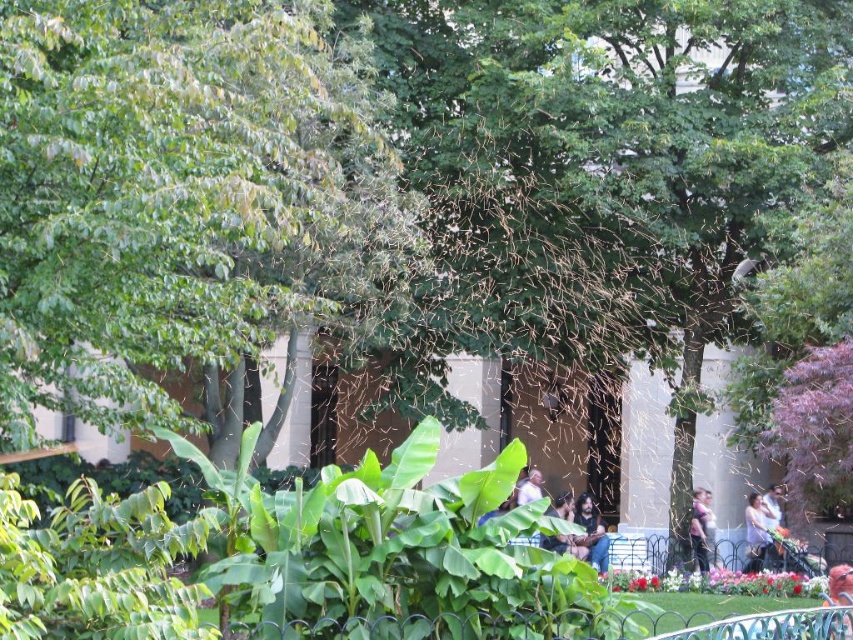
This screenshot has width=853, height=640. I want to click on smooth skin person at lower right, so click(x=755, y=532).

Measure the distance between point (747,502) and camera.

Point (747,502) is 37.67 meters from camera.

Where is `smooth skin person at lower right`? smooth skin person at lower right is located at coordinates (755, 532).

Is point (598, 540) positioned after point (761, 547)?

Yes, point (598, 540) is behind point (761, 547).

Measure the distance between dark brown leather jacket at center and camera.

109.44 feet

Identify the location of dark brown leather jacket at center. (590, 531).

I want to click on dark brown leather jacket at center, so click(590, 531).

Can you confirm if dark brown leather jacket at center is smaller than matte purple shirt at center?

Yes.

Can you confirm if dark brown leather jacket at center is bigger than matte purple shirt at center?

Incorrect, dark brown leather jacket at center is not larger than matte purple shirt at center.

Locate an element on the screen. The image size is (853, 640). dark brown leather jacket at center is located at coordinates (590, 531).

Where is `dark brown leather jacket at center`? This screenshot has width=853, height=640. dark brown leather jacket at center is located at coordinates (590, 531).